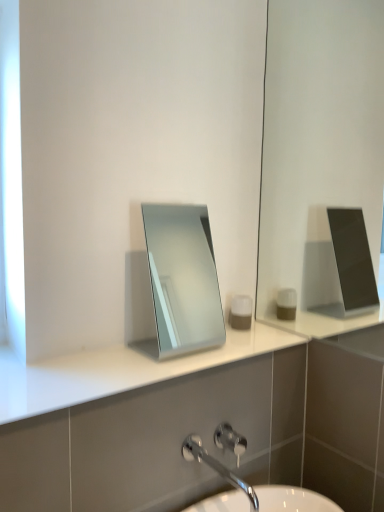
Locate an element on the screen. The width and height of the screenshot is (384, 512). vacant area that is situated to the right of silver metallic mirror at center is located at coordinates (236, 348).